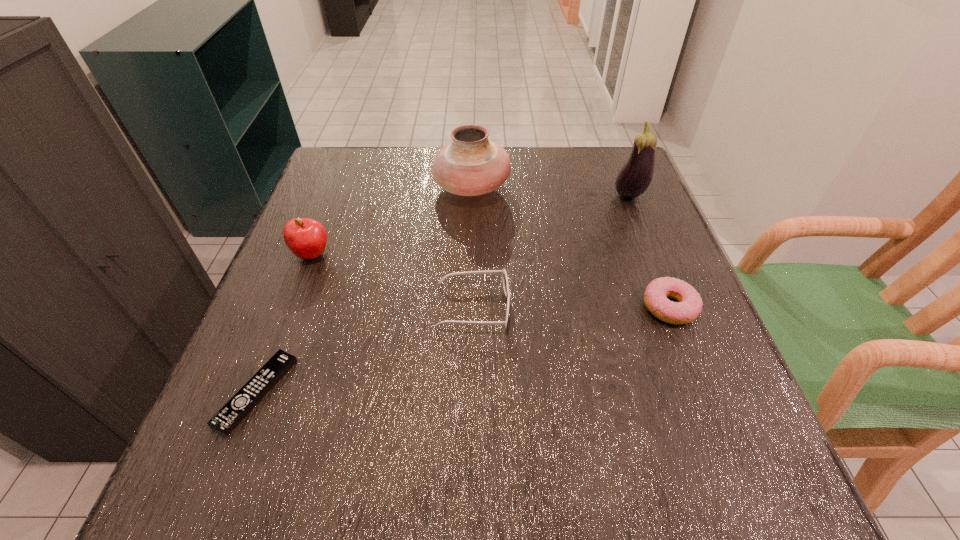
Locate an element on the screen. The height and width of the screenshot is (540, 960). vacant space that satisfies the following two spatial constraints: 1. on the front side of the pottery; 2. on the left side of the tallest object is located at coordinates 471,196.

Identify the location of vacant position in the image that satisfies the following two spatial constraints: 1. with the lenses of the sunglasses facing outward; 2. on the back side of the doughnut. (473, 307).

The width and height of the screenshot is (960, 540). I want to click on free space that satisfies the following two spatial constraints: 1. with the lenses of the doughnut facing outward; 2. on the left side of the sunglasses, so click(473, 307).

Identify the location of free space that satisfies the following two spatial constraints: 1. on the back side of the doughnut; 2. with the lenses of the sunglasses facing outward. (669, 306).